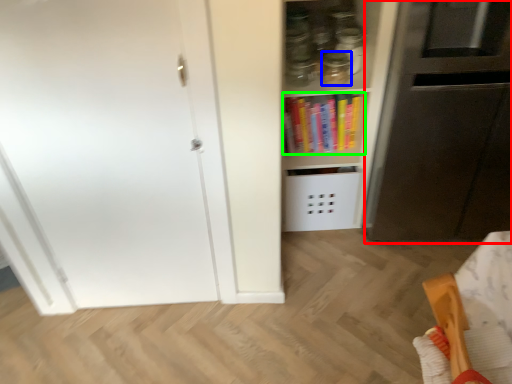
Question: Which is nearer to the appliance (highlighted by a red box)? glass jar (highlighted by a blue box) or book (highlighted by a green box).

Choices:
 (A) glass jar
 (B) book

Answer: (B)